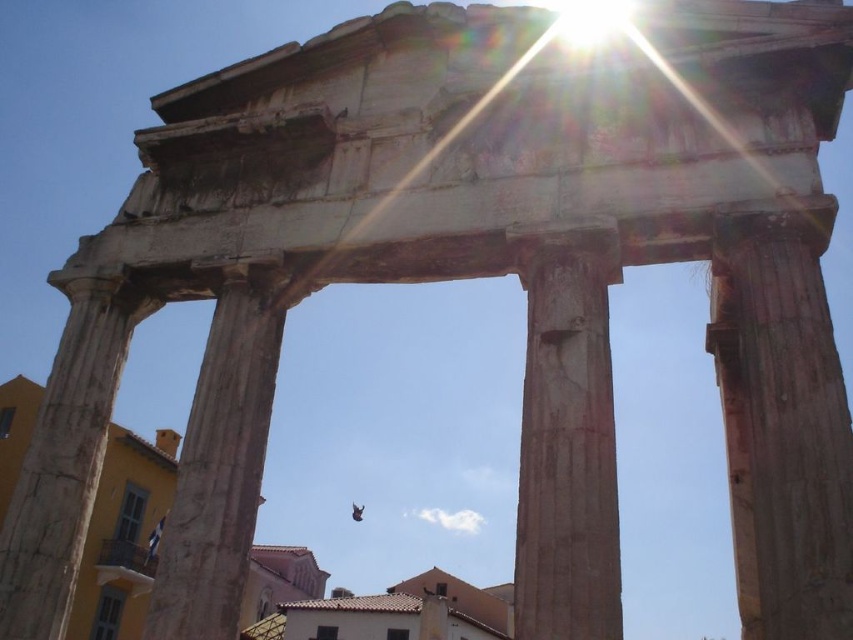
Is smooth stone column at right positioned behind brown stone column at center?

No.

Which is in front, point (831, 620) or point (563, 476)?

Point (831, 620)

Does point (846, 576) come closer to viewer compared to point (614, 500)?

Yes, it is.

Where is `smooth stone column at right`? The image size is (853, 640). smooth stone column at right is located at coordinates (782, 422).

Can you confirm if brown stone column at center is positioned to the right of smooth stone pillar at left?

Indeed, brown stone column at center is positioned on the right side of smooth stone pillar at left.

Can you confirm if brown stone column at center is thinner than smooth stone pillar at left?

No, brown stone column at center is not thinner than smooth stone pillar at left.

What do you see at coordinates (567, 440) in the screenshot?
I see `brown stone column at center` at bounding box center [567, 440].

I want to click on brown stone column at center, so click(x=567, y=440).

Can you confirm if smooth stone column at right is positioned above smooth stone column at center?

Indeed, smooth stone column at right is positioned over smooth stone column at center.

Is point (756, 381) in front of point (238, 276)?

Yes, it is.

At what (x,y) coordinates should I click in order to perform the action: click on smooth stone column at right. Please return your answer as a coordinate pair (x, y). Looking at the image, I should click on (782, 422).